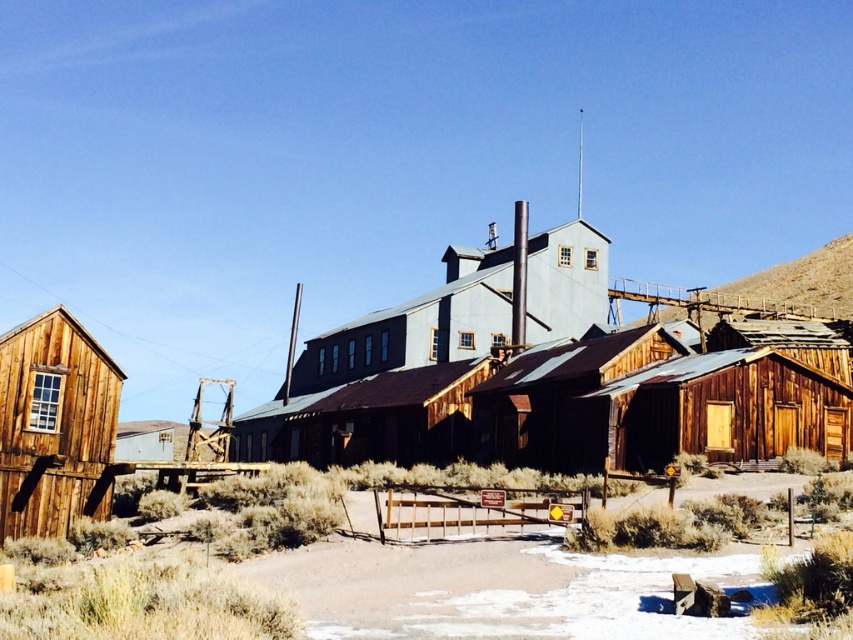
From the picture: Can you confirm if wooden hut at center is taller than rusty corrugated metal hut at center?

Indeed, wooden hut at center has a greater height compared to rusty corrugated metal hut at center.

At what (x,y) coordinates should I click in order to perform the action: click on wooden hut at center. Please return your answer as a coordinate pair (x, y). Looking at the image, I should click on (564, 403).

What do you see at coordinates (564, 403) in the screenshot?
I see `wooden hut at center` at bounding box center [564, 403].

Locate an element on the screen. This screenshot has height=640, width=853. wooden hut at center is located at coordinates (564, 403).

Between point (668, 422) and point (79, 323), which one is positioned behind?

Positioned behind is point (79, 323).

Between brown wooden hut at lower right and wooden cabin at left, which one is positioned higher?

brown wooden hut at lower right

The height and width of the screenshot is (640, 853). I want to click on brown wooden hut at lower right, so click(x=711, y=412).

Does point (648, 333) come in front of point (44, 529)?

No, it is not.

Identify the location of wooden hut at center. pyautogui.click(x=564, y=403).